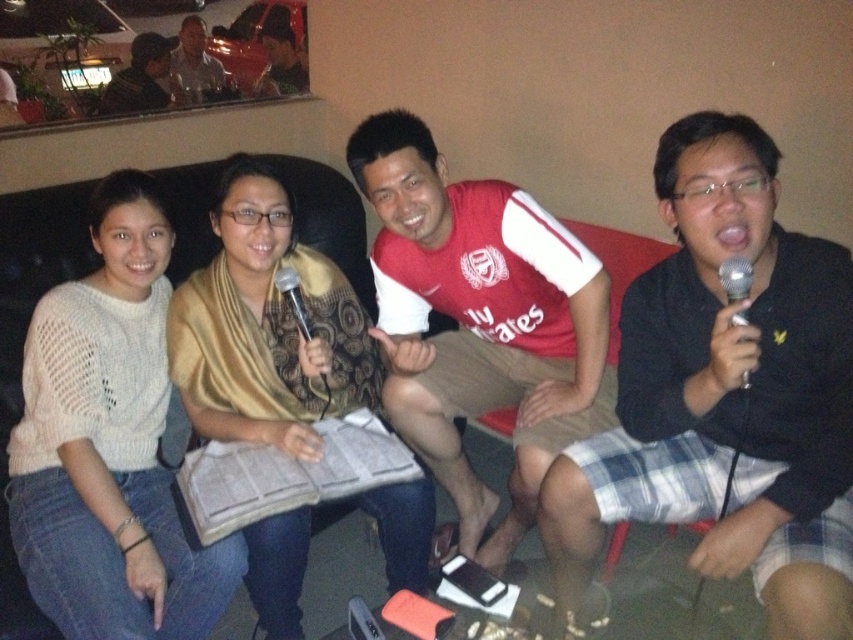
Question: Which of the following is the farthest from the observer?

Choices:
 (A) red jersey at center
 (B) patterned silk scarf at center
 (C) black matte shirt at right
 (D) dark brown leather jacket at upper left

Answer: (D)

Question: Which object is the closest to the red jersey at center?

Choices:
 (A) matte black shirt at upper center
 (B) silver metallic microphone at right

Answer: (B)

Question: Is black matte shirt at right wider than dark brown leather jacket at upper left?

Choices:
 (A) no
 (B) yes

Answer: (B)

Question: Is black matte shirt at right to the left of metallic silver microphone at center from the viewer's perspective?

Choices:
 (A) yes
 (B) no

Answer: (B)

Question: Is patterned silk scarf at center above silver metallic microphone at right?

Choices:
 (A) yes
 (B) no

Answer: (B)

Question: Which object is closer to the camera taking this photo?

Choices:
 (A) dark brown leather jacket at upper left
 (B) matte black shirt at upper left
 (C) black matte shirt at right
 (D) black fabric microphone at center

Answer: (C)